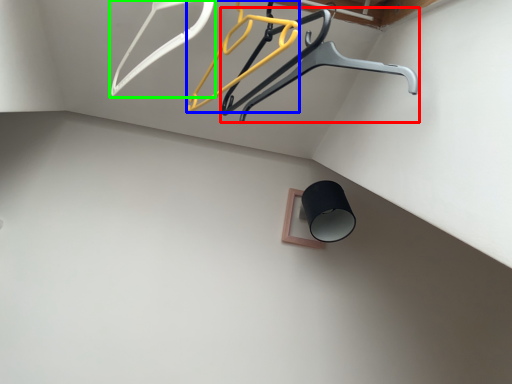
Question: Estimate the real-world distances between objects in this image. Which object is closer to furniture (highlighted by a red box), hanger (highlighted by a blue box) or hanger (highlighted by a green box)?

Choices:
 (A) hanger
 (B) hanger

Answer: (A)